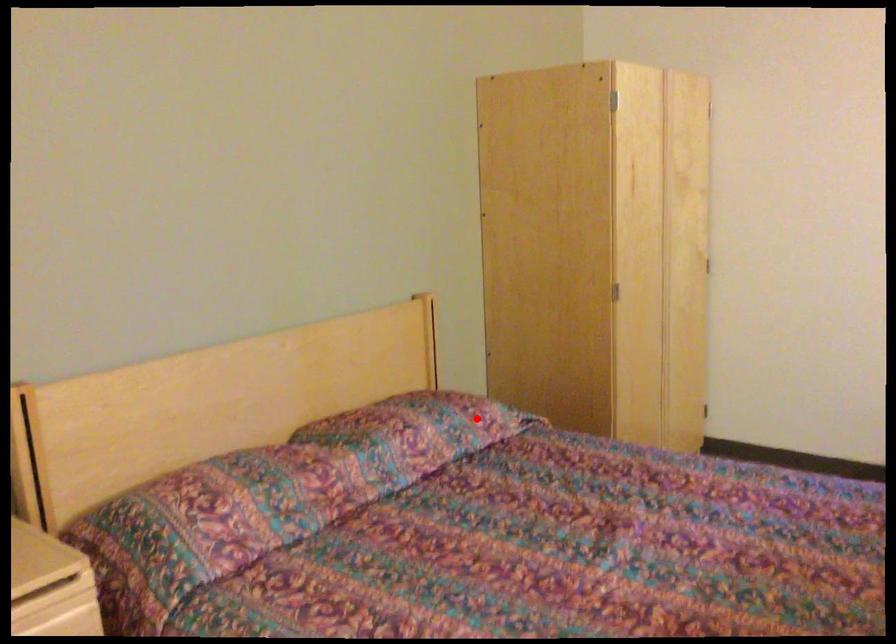
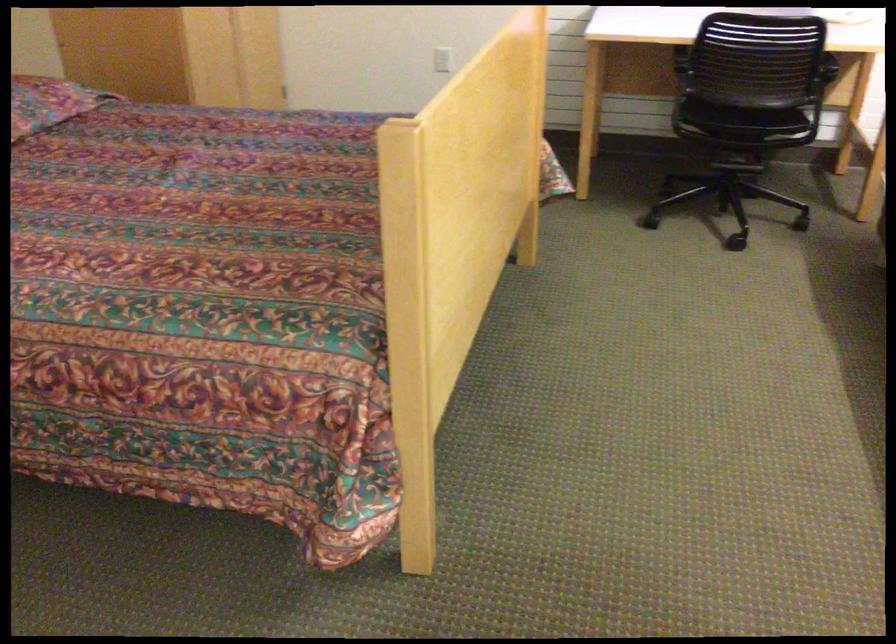
In the second image, find the point that corresponds to the highlighted location in the first image.

(48, 102)